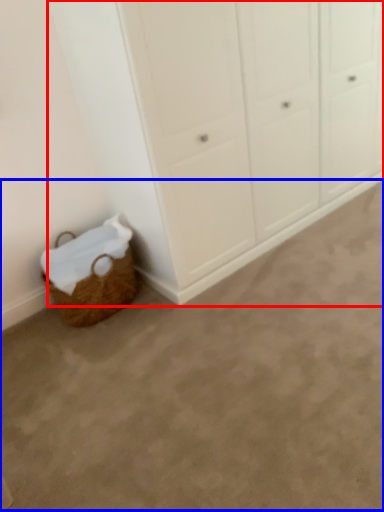
Question: Among these objects, which one is farthest to the camera, cupboard (highlighted by a red box) or plain (highlighted by a blue box)?

Choices:
 (A) cupboard
 (B) plain

Answer: (A)